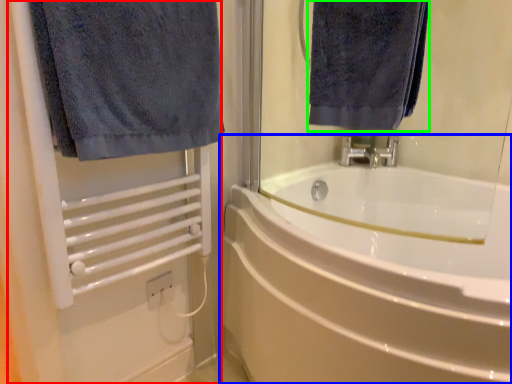
Question: Considering the real-world distances, which object is farthest from screen door (highlighted by a red box)? bathtub (highlighted by a blue box) or towel (highlighted by a green box)?

Choices:
 (A) bathtub
 (B) towel

Answer: (B)